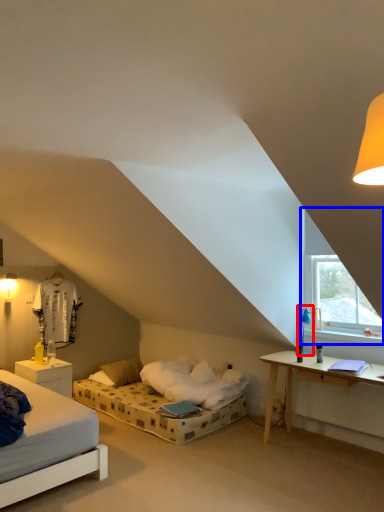
Question: Among these objects, which one is farthest to the camera, table lamp (highlighted by a red box) or window (highlighted by a blue box)?

Choices:
 (A) table lamp
 (B) window

Answer: (A)